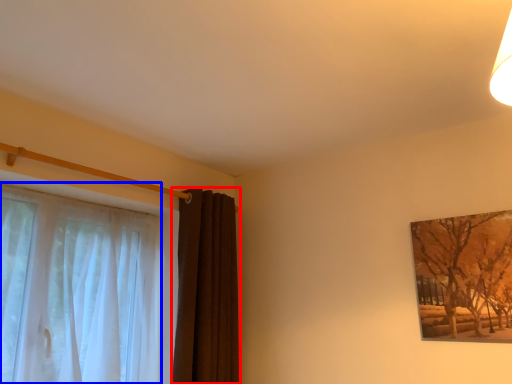
Question: Which point is closer to the camera, curtain (highlighted by a red box) or curtain (highlighted by a blue box)?

Choices:
 (A) curtain
 (B) curtain

Answer: (B)